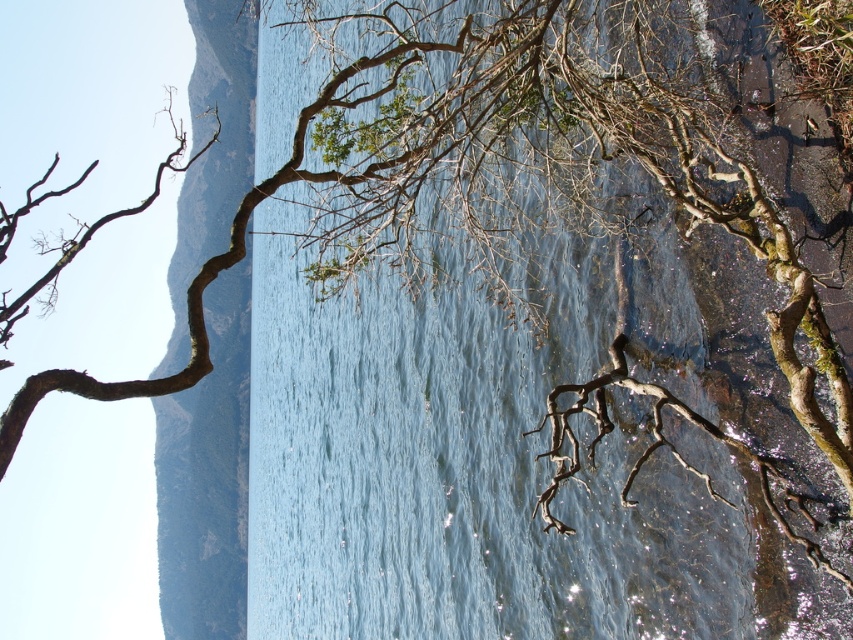
You are standing at the edge of the clear water at center and want to climb up to the brown rough cliff at left. Based on the scene description, is the cliff higher than the water surface?

The clear water at center is not as tall as brown rough cliff at left, so yes, the brown rough cliff at left is higher than the clear water at center.

You are a hiker standing at the brown rough cliff at left. You want to cross to the clear water at center. Is there a path directly between them?

The clear water at center is positioned over the brown rough cliff at left, which means the water is above the cliff. Since cliffs are typically elevated, you would need to descend or find a route around rather than a direct path between them.

You are a photographer planning to capture the clear water at center and the brown rough cliff at left in a single shot. Which object should you focus on first if you want both to be in sharp focus?

You should focus on the brown rough cliff at left first because it is larger than the clear water at center, allowing for a greater depth of field to keep both objects in focus.